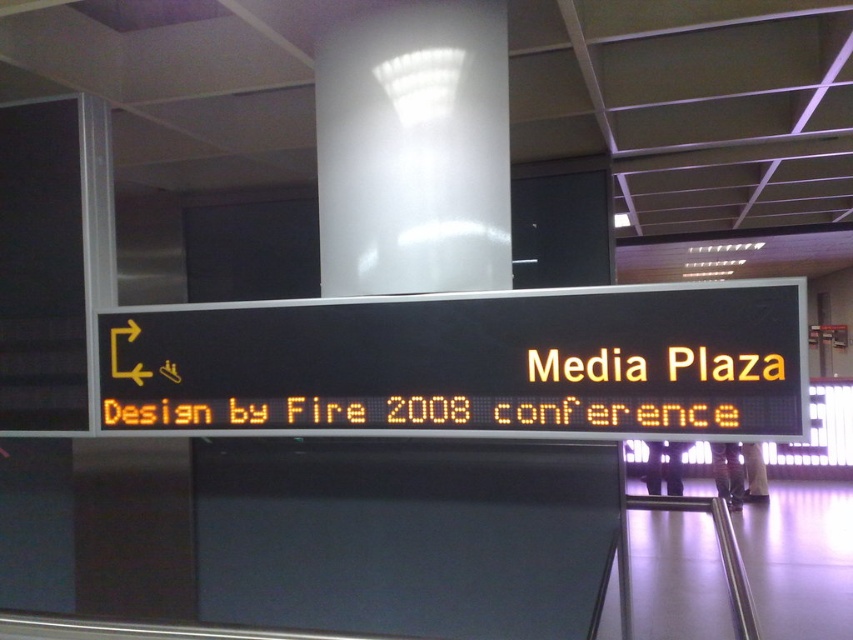
You are standing in front of the signboard and need to locate the yellow led display at center and the white glossy pillar at upper center. According to the layout, which one is positioned to the right side?

A: The yellow led display at center is positioned to the right of the white glossy pillar at upper center.